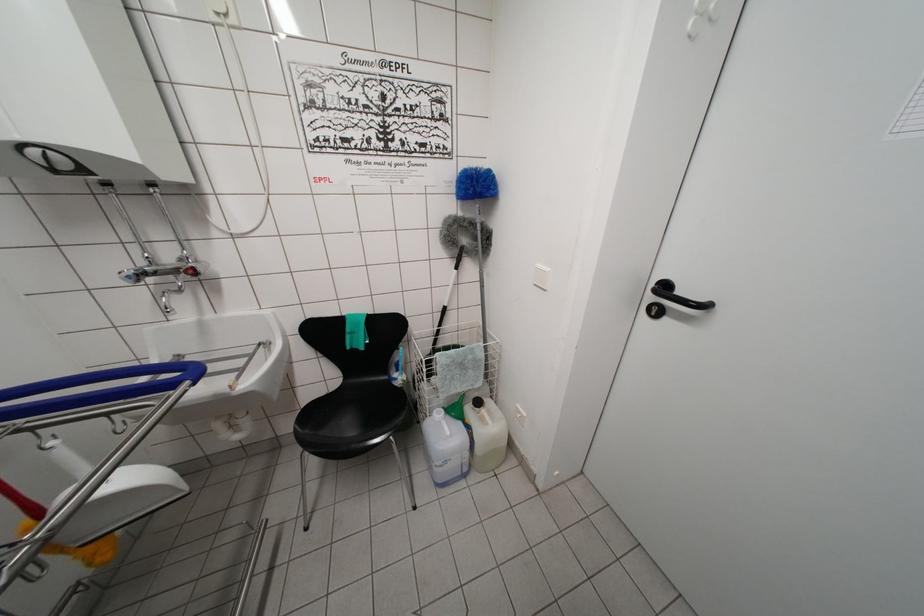
Find where to lift the clear plastic jug. Please return your answer as a coordinate pair (x, y).

(445, 448)